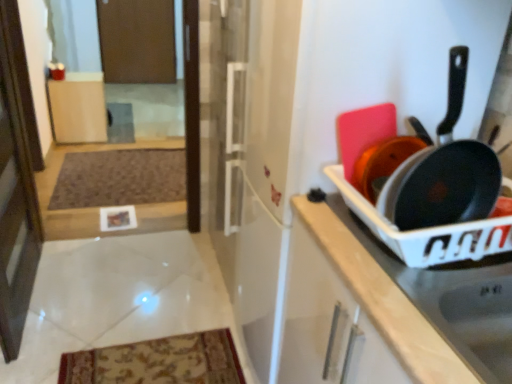
In the scene shown: What is the approximate height of matte wood cabinet at center, which is the 2th cabinetry from front to back?

matte wood cabinet at center, which is the 2th cabinetry from front to back, is 22.97 inches tall.

Where is `brown matte screen door at upper center, the first screen door from the top`? Image resolution: width=512 pixels, height=384 pixels. brown matte screen door at upper center, the first screen door from the top is located at coordinates (137, 41).

Measure the distance between point (25, 226) and camera.

1.98 meters.

Describe the element at coordinates (353, 313) in the screenshot. I see `white plastic tray at right, arranged as the first cabinetry when viewed from the front` at that location.

What do you see at coordinates (444, 171) in the screenshot? I see `matte black frying pan at right` at bounding box center [444, 171].

Locate an element on the screen. The width and height of the screenshot is (512, 384). matte wood cabinet at center, marked as the second cabinetry in a bottom-to-top arrangement is located at coordinates (78, 108).

Is matte wood cabinet at center, which is the first cabinetry from left to right, inside or outside of matte black pan at right?

matte wood cabinet at center, which is the first cabinetry from left to right, is not inside matte black pan at right, it's outside.

How different are the orientations of matte wood cabinet at center, the first cabinetry viewed from the back, and matte black pan at right in degrees?

There is a 177-degree angle between the facing directions of matte wood cabinet at center, the first cabinetry viewed from the back, and matte black pan at right.

Is matte wood cabinet at center, which is the 2th cabinetry from front to back, bigger or smaller than matte black pan at right?

Considering their sizes, matte wood cabinet at center, which is the 2th cabinetry from front to back, takes up more space than matte black pan at right.

Is the position of white plastic tray at right, marked as the first cabinetry in a bottom-to-top arrangement, more distant than that of brown textured mat at lower left?

No, white plastic tray at right, marked as the first cabinetry in a bottom-to-top arrangement, is in front of brown textured mat at lower left.

The width and height of the screenshot is (512, 384). In order to click on cabinetry on the right of the brown textured mat at lower left in this screenshot , I will do `click(353, 313)`.

Is brown textured mat at lower left thinner than brown matte screen door at upper center, which is counted as the 2th screen door, starting from the bottom?

In fact, brown textured mat at lower left might be wider than brown matte screen door at upper center, which is counted as the 2th screen door, starting from the bottom.

Locate an element on the screen. This screenshot has height=384, width=512. mat below the brown matte screen door at upper center, marked as the 1th screen door in a back-to-front arrangement (from the image's perspective) is located at coordinates (120, 178).

Does point (184, 191) come farther from viewer compared to point (128, 25)?

No, it is in front of (128, 25).

Is point (433, 363) closer or farther from the camera than point (101, 125)?

Point (433, 363) is positioned closer to the camera compared to point (101, 125).

Is white plastic tray at right, arranged as the first cabinetry when viewed from the front, directly adjacent to matte wood cabinet at center, which is the second cabinetry from right to left?

No.

Is white plastic tray at right, which is counted as the first cabinetry, starting from the right, taller than matte wood cabinet at center, which is the first cabinetry from left to right?

In fact, white plastic tray at right, which is counted as the first cabinetry, starting from the right, may be shorter than matte wood cabinet at center, which is the first cabinetry from left to right.

Considering the sizes of objects white plastic tray at right, which is counted as the first cabinetry, starting from the right, and matte wood cabinet at center, the first cabinetry from the top, in the image provided, who is thinner, white plastic tray at right, which is counted as the first cabinetry, starting from the right, or matte wood cabinet at center, the first cabinetry from the top,?

Thinner between the two is matte wood cabinet at center, the first cabinetry from the top.

In the scene shown: How distant is matte black pan at right from transparent glass screen door at left, marked as the 2th screen door in a back-to-front arrangement?

matte black pan at right is 1.56 meters from transparent glass screen door at left, marked as the 2th screen door in a back-to-front arrangement.

Can you confirm if matte black pan at right is shorter than transparent glass screen door at left, marked as the 2th screen door in a back-to-front arrangement?

Correct, matte black pan at right is not as tall as transparent glass screen door at left, marked as the 2th screen door in a back-to-front arrangement.

Is matte black pan at right bigger than transparent glass screen door at left, positioned as the 2th screen door in top-to-bottom order?

No, matte black pan at right is not bigger than transparent glass screen door at left, positioned as the 2th screen door in top-to-bottom order.

From a real-world perspective, which is physically above, matte black pan at right or transparent glass screen door at left, positioned as the 2th screen door in top-to-bottom order?

matte black pan at right.

Looking at this image, how different are the orientations of matte black frying pan at right and brown matte screen door at upper center, which is counted as the 2th screen door, starting from the bottom, in degrees?

They differ by 4 degrees in their facing directions.

Considering the sizes of matte black frying pan at right and brown matte screen door at upper center, which ranks as the second screen door in front-to-back order, in the image, is matte black frying pan at right taller or shorter than brown matte screen door at upper center, which ranks as the second screen door in front-to-back order,?

Considering their sizes, matte black frying pan at right has less height than brown matte screen door at upper center, which ranks as the second screen door in front-to-back order.

Is matte black frying pan at right facing towards brown matte screen door at upper center, which ranks as the second screen door in front-to-back order?

No, matte black frying pan at right is not facing towards brown matte screen door at upper center, which ranks as the second screen door in front-to-back order.

Considering the sizes of objects matte black frying pan at right and brown matte screen door at upper center, the first screen door from the top, in the image provided, who is bigger, matte black frying pan at right or brown matte screen door at upper center, the first screen door from the top,?

brown matte screen door at upper center, the first screen door from the top, is bigger.

Considering the relative sizes of matte wood cabinet at center, marked as the second cabinetry in a bottom-to-top arrangement, and brown textured mat at lower left in the image provided, is matte wood cabinet at center, marked as the second cabinetry in a bottom-to-top arrangement, shorter than brown textured mat at lower left?

No, matte wood cabinet at center, marked as the second cabinetry in a bottom-to-top arrangement, is not shorter than brown textured mat at lower left.

How distant is matte wood cabinet at center, the first cabinetry from the top, from brown textured mat at lower left?

They are 27.09 inches apart.

What's the angular difference between matte wood cabinet at center, which is the first cabinetry from left to right, and brown textured mat at lower left's facing directions?

The angular difference between matte wood cabinet at center, which is the first cabinetry from left to right, and brown textured mat at lower left is 90 degrees.

Can you confirm if matte wood cabinet at center, which is the second cabinetry from right to left, is smaller than brown textured mat at lower left?

No, matte wood cabinet at center, which is the second cabinetry from right to left, is not smaller than brown textured mat at lower left.

Image resolution: width=512 pixels, height=384 pixels. What are the coordinates of `appliance that is below the matte wood cabinet at center, which is the 2th cabinetry from front to back (from the image's perspective)` in the screenshot? It's located at (426, 232).

Identify the location of mat on the left of the white plastic tray at right, marked as the first cabinetry in a bottom-to-top arrangement. (x=120, y=178).

Based on their spatial positions, is transparent glass screen door at left, marked as the 2th screen door in a back-to-front arrangement, or white plastic tray at right, which is the second cabinetry in left-to-right order, closer to matte black pan at right?

white plastic tray at right, which is the second cabinetry in left-to-right order, is closer to matte black pan at right.

Looking at the image, which one is located closer to brown matte screen door at upper center, marked as the 1th screen door in a back-to-front arrangement, matte black frying pan at right or white plastic tray at right, which appears as the 2th cabinetry when viewed from the back?

white plastic tray at right, which appears as the 2th cabinetry when viewed from the back, lies closer to brown matte screen door at upper center, marked as the 1th screen door in a back-to-front arrangement, than the other object.

Based on their spatial positions, is matte wood cabinet at center, which is the first cabinetry from left to right, or brown matte screen door at upper center, which is counted as the 2th screen door, starting from the bottom, further from white plastic tray at right, which is the second cabinetry in left-to-right order?

brown matte screen door at upper center, which is counted as the 2th screen door, starting from the bottom, is further to white plastic tray at right, which is the second cabinetry in left-to-right order.

Looking at the image, which one is located closer to white plastic tray at right, marked as the first cabinetry in a bottom-to-top arrangement, matte black pan at right or matte black frying pan at right?

The object closer to white plastic tray at right, marked as the first cabinetry in a bottom-to-top arrangement, is matte black pan at right.

Looking at the image, which one is located further to brown matte screen door at upper center, marked as the 1th screen door in a back-to-front arrangement, white plastic tray at right, which is the second cabinetry in left-to-right order, or matte wood cabinet at center, the first cabinetry from the top?

Among the two, white plastic tray at right, which is the second cabinetry in left-to-right order, is located further to brown matte screen door at upper center, marked as the 1th screen door in a back-to-front arrangement.

Which object lies nearer to the anchor point brown matte screen door at upper center, the first screen door from the top, brown textured mat at lower left or matte wood cabinet at center, marked as the second cabinetry in a bottom-to-top arrangement?

The object closer to brown matte screen door at upper center, the first screen door from the top, is matte wood cabinet at center, marked as the second cabinetry in a bottom-to-top arrangement.

From the image, which object appears to be farther from brown textured mat at lower left, matte black frying pan at right or transparent glass screen door at left, which ranks as the first screen door in bottom-to-top order?

Based on the image, matte black frying pan at right appears to be further to brown textured mat at lower left.

In the scene shown: Considering their positions, is matte black pan at right positioned closer to matte black frying pan at right than white plastic tray at right, marked as the first cabinetry in a bottom-to-top arrangement?

The object closer to matte black frying pan at right is matte black pan at right.

Find the location of a particular element. appliance between matte black frying pan at right and brown matte screen door at upper center, which ranks as the second screen door in front-to-back order, from front to back is located at coordinates (426, 232).

Image resolution: width=512 pixels, height=384 pixels. I want to click on mat between transparent glass screen door at left, the 1th screen door viewed from the front, and brown matte screen door at upper center, the first screen door from the top, along the z-axis, so click(x=120, y=178).

This screenshot has height=384, width=512. In order to click on appliance situated between transparent glass screen door at left, positioned as the 2th screen door in top-to-bottom order, and white plastic tray at right, which is counted as the first cabinetry, starting from the right, from left to right in this screenshot , I will do `click(426, 232)`.

Where is `mat between white plastic tray at right, arranged as the second cabinetry when viewed from the top, and brown matte screen door at upper center, the first screen door from the top, from front to back`? Image resolution: width=512 pixels, height=384 pixels. mat between white plastic tray at right, arranged as the second cabinetry when viewed from the top, and brown matte screen door at upper center, the first screen door from the top, from front to back is located at coordinates (120, 178).